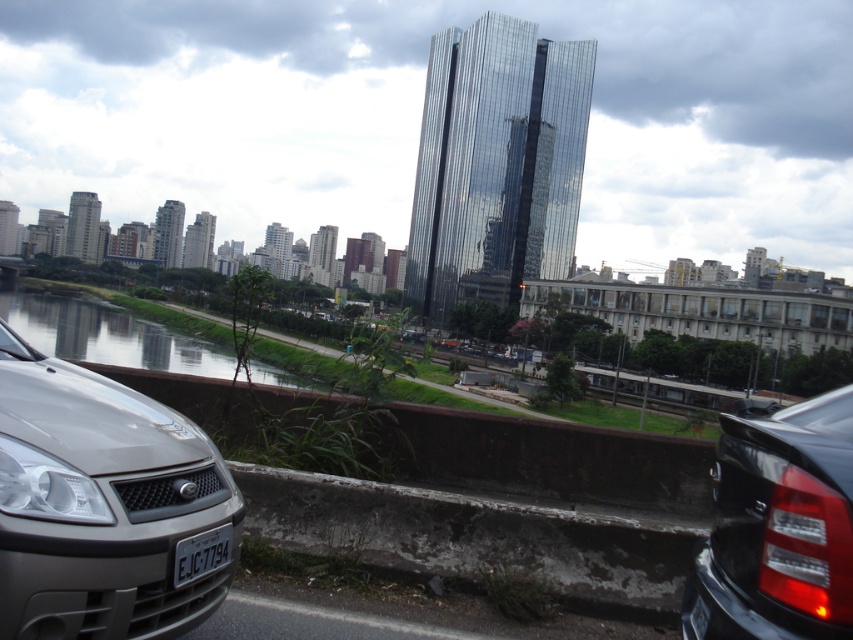
You are a delivery robot with a 1.5 meter long package. You need to move the package from the white plastic license plate at lower center to the black glossy car at right. Can you carry it directly without rotating the package?

The distance between the white plastic license plate at lower center and the black glossy car at right is 1.88 meters. Since the package is 1.5 meters long, the robot can carry it directly as the distance is sufficient.

You are a delivery driver who needs to park your vehicle between the satin silver car at lower left and the black glossy car at right. Considering their sizes, which car should you position closer to when parking to ensure enough space?

Since the satin silver car at lower left is smaller than the black glossy car at right, you should position your vehicle closer to the satin silver car at lower left to accommodate the space needed for both vehicles.

You are standing at the point marked by the coordinates point (105, 506) in the image. Which object are you touching?

The point (105, 506) is on the satin silver car at lower left, so you are touching the satin silver car at lower left.